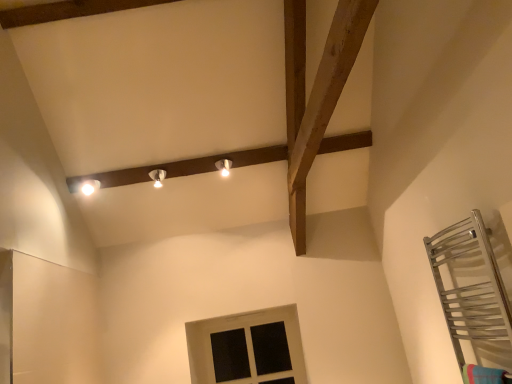
Question: Do you think white painted wood window at lower center is within matte white light fixture at upper left, the 1th light fixture from the left, or outside of it?

Choices:
 (A) outside
 (B) inside

Answer: (A)

Question: Considering the positions of white painted wood window at lower center and matte white light fixture at upper left, the 3th light fixture in the right-to-left sequence, in the image, is white painted wood window at lower center bigger or smaller than matte white light fixture at upper left, the 3th light fixture in the right-to-left sequence,?

Choices:
 (A) big
 (B) small

Answer: (A)

Question: Estimate the real-world distances between objects in this image. Which object is farther from the matte white light fixture at center, which appears as the 2th light fixture when viewed from the left?

Choices:
 (A) white painted wood window at lower center
 (B) matte white light fixture at upper center, marked as the first light fixture in a right-to-left arrangement
 (C) matte white light fixture at upper left, the 1th light fixture from the left

Answer: (A)

Question: Considering the real-world distances, which object is closest to the white painted wood window at lower center?

Choices:
 (A) matte white light fixture at upper center, marked as the first light fixture in a right-to-left arrangement
 (B) matte white light fixture at center, the 2th light fixture from the right
 (C) matte white light fixture at upper left, the 3th light fixture in the right-to-left sequence

Answer: (A)